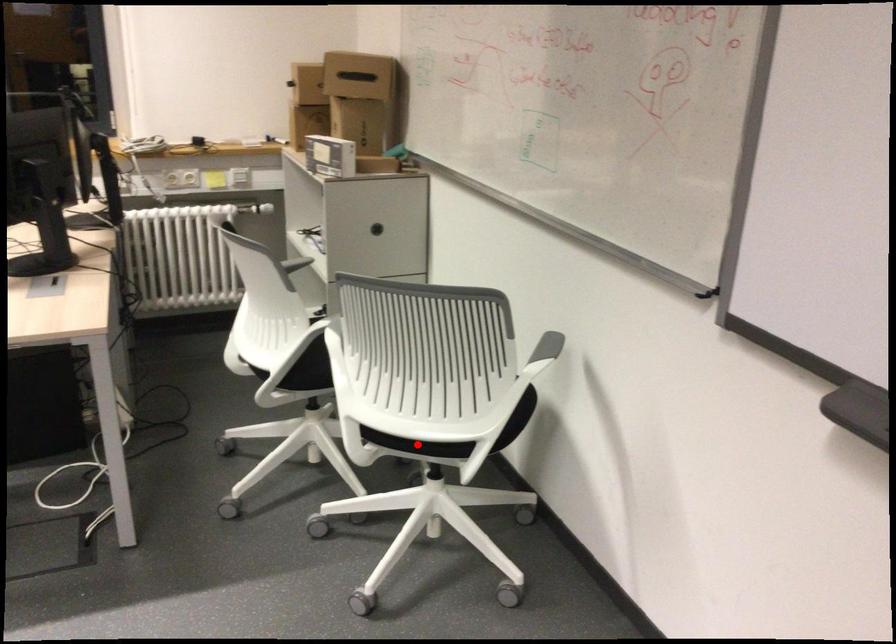
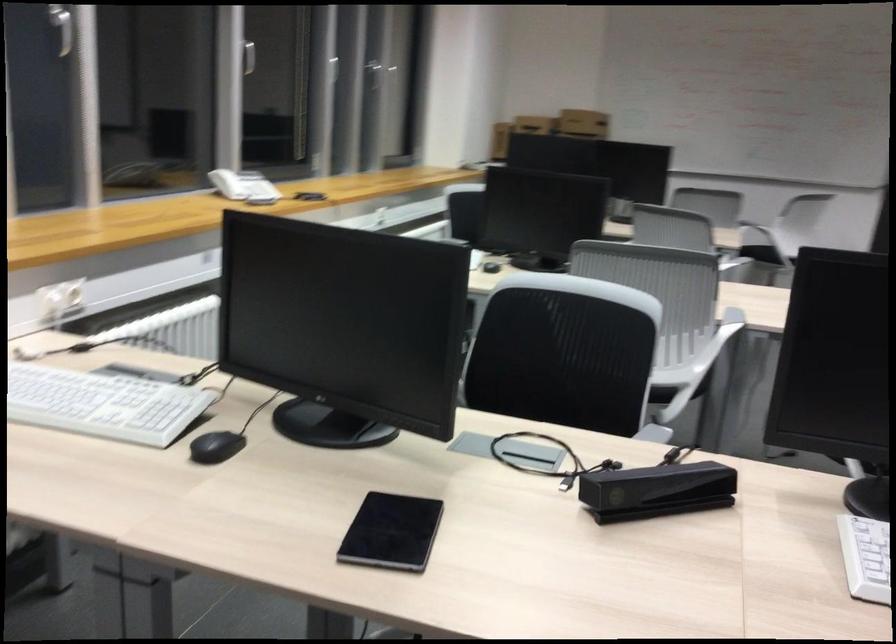
Question: I am providing you with two images of the same scene from different viewpoints. A red point is marked on the first image. At the location where the point appears in image 1, is it still visible in image 2?

Choices:
 (A) Yes
 (B) No

Answer: (B)